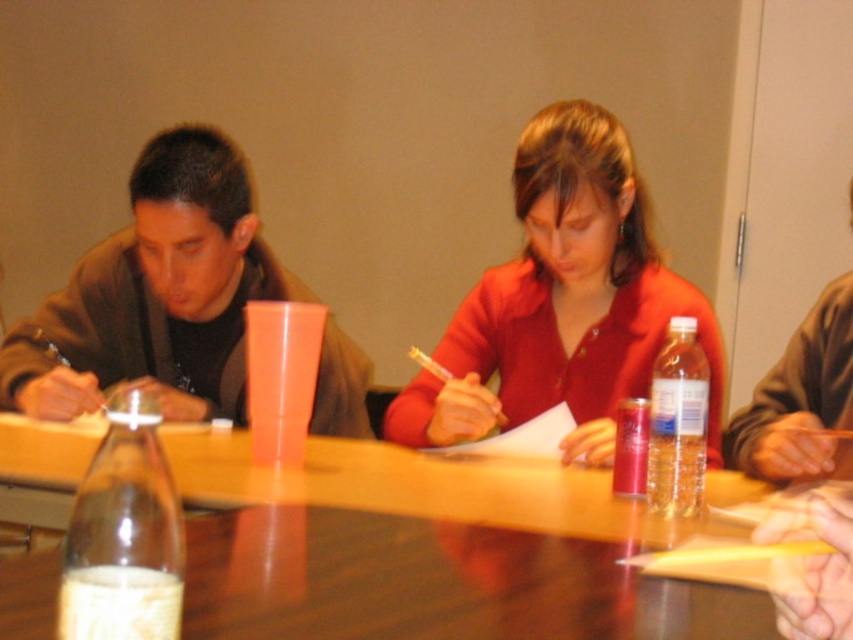
Question: Among these objects, which one is nearest to the camera?

Choices:
 (A) matte red shirt at center
 (B) wooden table at center
 (C) translucent plastic water bottle at table right
 (D) clear plastic bottle at lower left

Answer: (D)

Question: Which object is the closest to the matte red shirt at center?

Choices:
 (A) wooden table at center
 (B) clear plastic bottle at lower left

Answer: (A)

Question: Is matte red shirt at center wider than matte brown jacket at left?

Choices:
 (A) no
 (B) yes

Answer: (A)

Question: Does matte red shirt at center have a larger size compared to translucent plastic water bottle at table right?

Choices:
 (A) no
 (B) yes

Answer: (B)

Question: Can you confirm if matte red shirt at center is positioned to the left of wooden table at center?

Choices:
 (A) no
 (B) yes

Answer: (A)

Question: Which of the following is the farthest from the observer?

Choices:
 (A) (583, 516)
 (B) (131, 561)

Answer: (A)